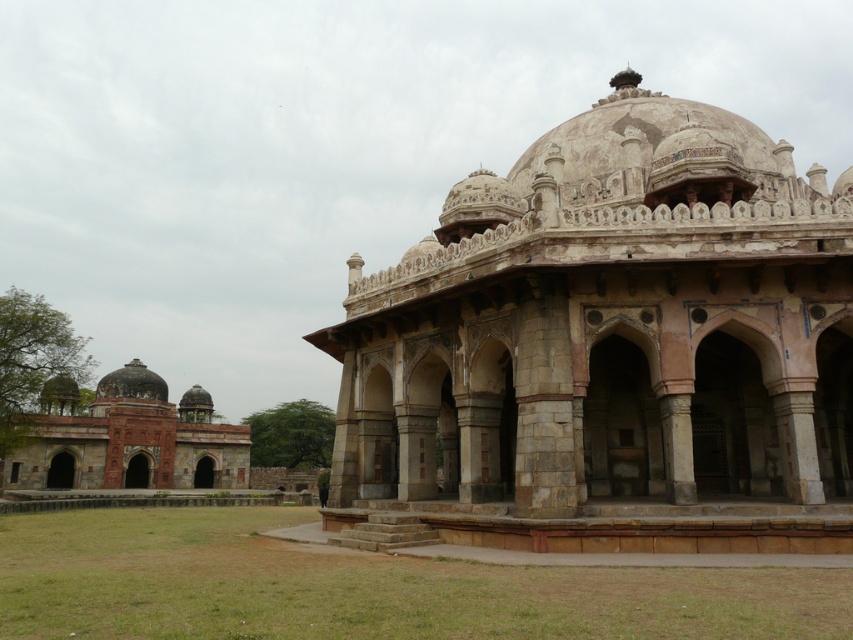
You are standing at the entrance of the historical structure and see two points marked on the ground. The first point is at coordinate point (613, 332) and the second is at point (62, 426). Which point is closer to you as you face the building?

Point (613, 332) is in front of point (62, 426), so the first point is closer to you.